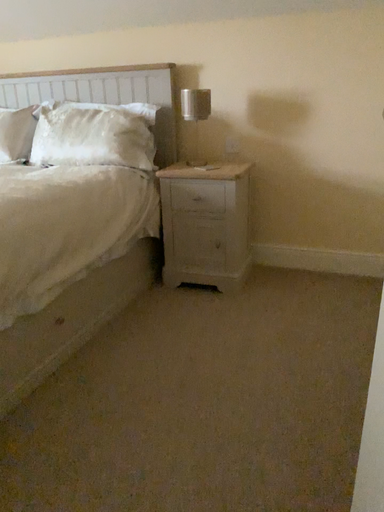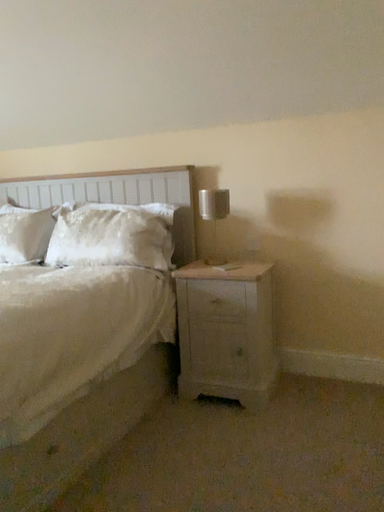
Question: How did the camera likely rotate when shooting the video?

Choices:
 (A) rotated downward
 (B) rotated upward

Answer: (B)